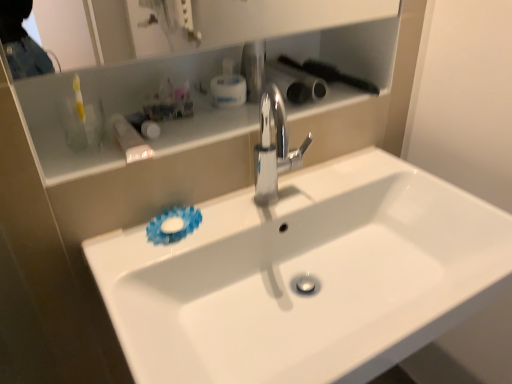
Question: Does translucent plastic container at upper left turn towards white glossy cabinet at upper center?

Choices:
 (A) no
 (B) yes

Answer: (B)

Question: Does translucent plastic container at upper left have a smaller size compared to white glossy cabinet at upper center?

Choices:
 (A) no
 (B) yes

Answer: (B)

Question: From the image's perspective, is translucent plastic container at upper left on top of white glossy cabinet at upper center?

Choices:
 (A) yes
 (B) no

Answer: (B)

Question: From a real-world perspective, does translucent plastic container at upper left sit lower than white glossy cabinet at upper center?

Choices:
 (A) no
 (B) yes

Answer: (B)

Question: Is translucent plastic container at upper left not close to white glossy cabinet at upper center?

Choices:
 (A) no
 (B) yes

Answer: (A)

Question: Does translucent plastic container at upper left come in front of white glossy cabinet at upper center?

Choices:
 (A) yes
 (B) no

Answer: (B)

Question: Are white glossy sink at center and polished chrome faucet at center far apart?

Choices:
 (A) yes
 (B) no

Answer: (B)

Question: Is white glossy sink at center closer to camera compared to polished chrome faucet at center?

Choices:
 (A) no
 (B) yes

Answer: (B)

Question: Does white glossy sink at center appear on the left side of polished chrome faucet at center?

Choices:
 (A) no
 (B) yes

Answer: (A)

Question: From a real-world perspective, is white glossy sink at center located higher than polished chrome faucet at center?

Choices:
 (A) no
 (B) yes

Answer: (A)

Question: Is polished chrome faucet at center completely or partially inside white glossy sink at center?

Choices:
 (A) yes
 (B) no

Answer: (B)

Question: Is white glossy sink at center bigger than polished chrome faucet at center?

Choices:
 (A) yes
 (B) no

Answer: (A)

Question: Is translucent plastic container at upper left at the left side of polished chrome faucet at center?

Choices:
 (A) yes
 (B) no

Answer: (A)